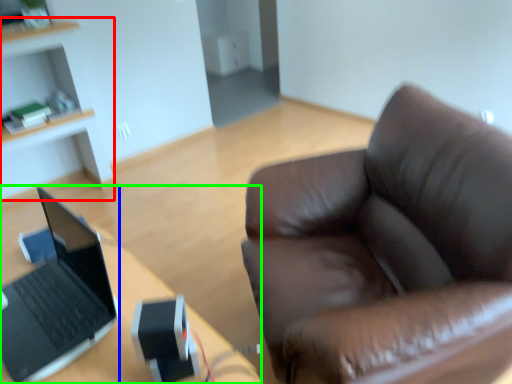
Question: Which object is positioned closest to cabinetry (highlighted by a red box)? Select from laptop (highlighted by a blue box) and desk (highlighted by a green box).

Choices:
 (A) laptop
 (B) desk

Answer: (B)